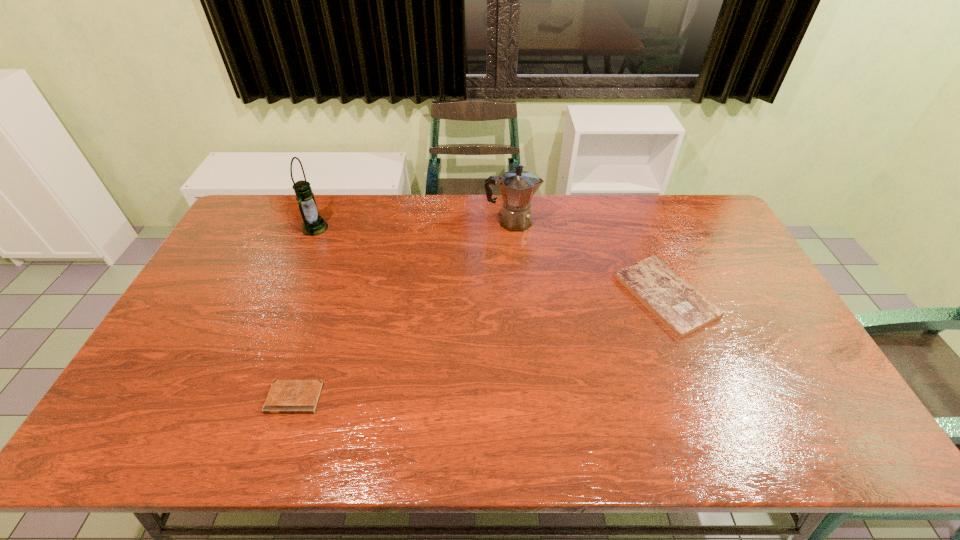
Find the location of a particular element. free space located 0.250m on the front of the third tallest object is located at coordinates (717, 425).

Locate an element on the screen. vacant space located on the spine side of the second object from left to right is located at coordinates (279, 442).

Where is `lantern located in the far edge section of the desktop`? lantern located in the far edge section of the desktop is located at coordinates (313, 224).

Find the location of a particular element. coffeepot located in the far edge section of the desktop is located at coordinates (517, 187).

The image size is (960, 540). I want to click on blank space at the far edge, so [380, 234].

In the image, there is a desktop. In order to click on vacant area at the near edge in this screenshot , I will do `click(586, 431)`.

This screenshot has width=960, height=540. I want to click on free space at the left edge of the desktop, so click(218, 343).

The height and width of the screenshot is (540, 960). In the image, there is a desktop. What are the coordinates of `vacant region at the right edge` in the screenshot? It's located at (756, 319).

The height and width of the screenshot is (540, 960). I want to click on free spot at the near left corner of the desktop, so [x=158, y=438].

You are a GUI agent. You are given a task and a screenshot of the screen. Output one action in this format:
    pyautogui.click(x=<x>, y=<y>)
    Task: Click on the free spot between the tallest object and the second object from right to left
    The height and width of the screenshot is (540, 960).
    Given the screenshot: What is the action you would take?
    pyautogui.click(x=414, y=225)